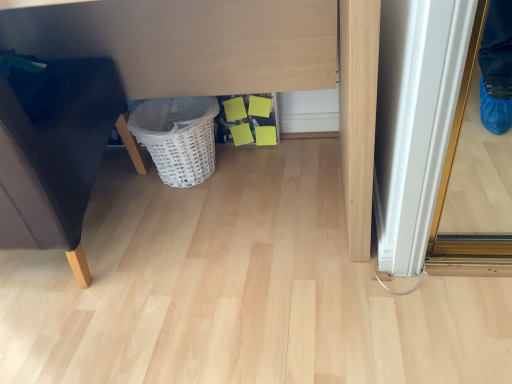
Identify the location of empty space that is in between matte white vanity at center and matte black sofa at left. (183, 278).